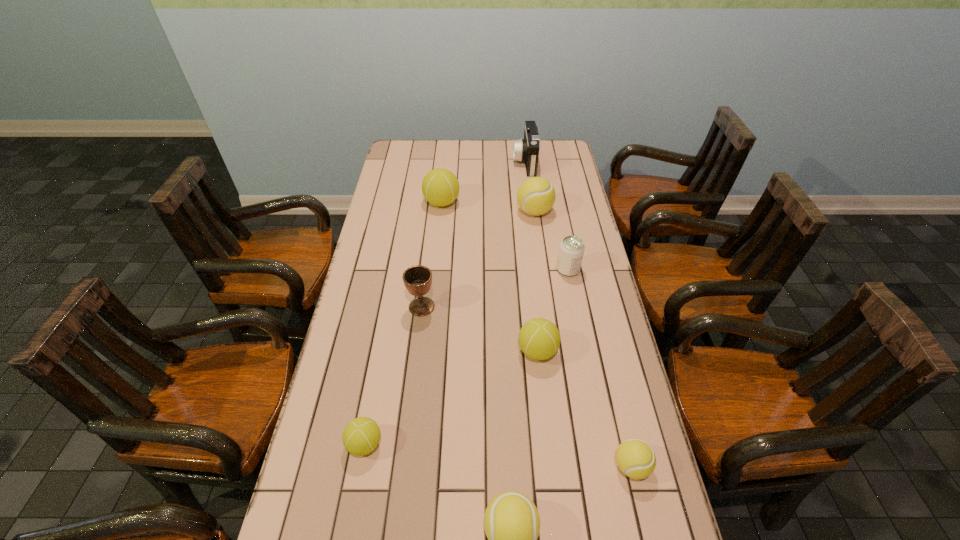
Where is `vacant space located 0.390m on the front of the soda can`? vacant space located 0.390m on the front of the soda can is located at coordinates (x=589, y=377).

You are a GUI agent. You are given a task and a screenshot of the screen. Output one action in this format:
    pyautogui.click(x=<x>, y=<y>)
    Task: Click on the free location located 0.300m on the left of the fourth nearest tennis ball
    This screenshot has width=960, height=540.
    Given the screenshot: What is the action you would take?
    pyautogui.click(x=416, y=351)

Identify the location of vacant space located 0.350m on the back of the second nearest yellow tennis ball. (601, 335).

Identify the location of blank space located on the right of the nearest green tennis ball. click(x=469, y=444).

Identify the location of object that is at the far edge. (527, 149).

Locate an element on the screen. The image size is (960, 540). object that is at the left edge is located at coordinates [361, 436].

This screenshot has width=960, height=540. I want to click on camcorder present at the right edge, so (527, 149).

Where is `soda can positioned at the right edge`? soda can positioned at the right edge is located at coordinates (571, 250).

Locate an element on the screen. This screenshot has height=540, width=960. object that is at the far right corner is located at coordinates (527, 149).

This screenshot has height=540, width=960. In order to click on vacant space at the left edge of the desktop in this screenshot , I will do `click(397, 215)`.